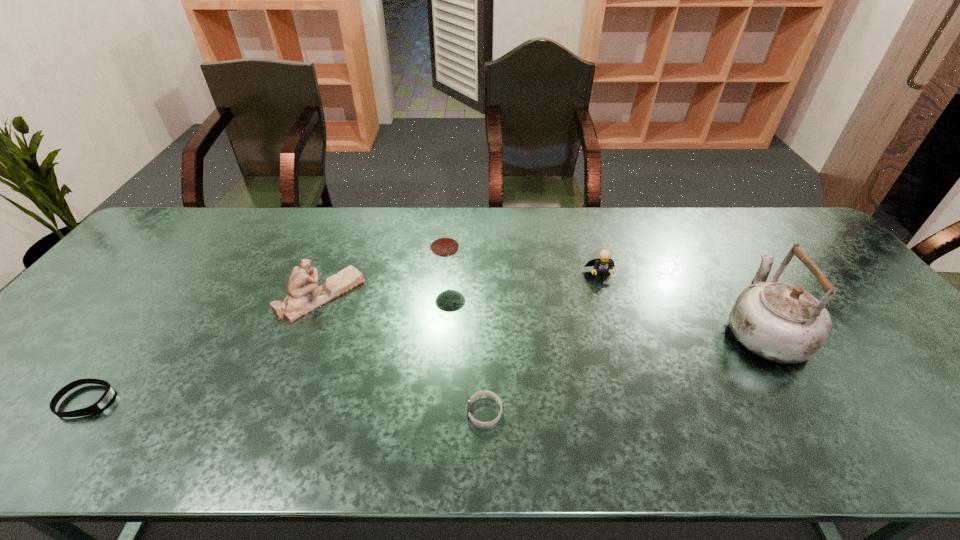
The height and width of the screenshot is (540, 960). Find the location of `blank space located 0.320m at the spout of the tallest object`. blank space located 0.320m at the spout of the tallest object is located at coordinates (700, 228).

In order to click on vacant space located on the right of the wineglass in this screenshot , I will do `click(565, 276)`.

Where is `vacant region located on the front-facing side of the second object from left to right`? vacant region located on the front-facing side of the second object from left to right is located at coordinates (379, 295).

This screenshot has width=960, height=540. Identify the location of blank area located 0.270m on the front-facing side of the third shortest object. (625, 355).

Image resolution: width=960 pixels, height=540 pixels. Identify the location of vacant space situated 0.180m on the outer surface of the fourth object from left to right. coord(386,412).

Identify the location of vacant region located on the outer surface of the fourth object from left to right. This screenshot has width=960, height=540. (376, 412).

The image size is (960, 540). In order to click on free space located 0.100m on the outer surface of the fourth object from left to right in this screenshot , I will do `click(422, 412)`.

This screenshot has height=540, width=960. Identify the location of vacant region located on the display of the left wristband. (153, 401).

I want to click on object located at the near edge, so click(484, 392).

Where is `object situated at the left edge`? This screenshot has height=540, width=960. object situated at the left edge is located at coordinates (109, 393).